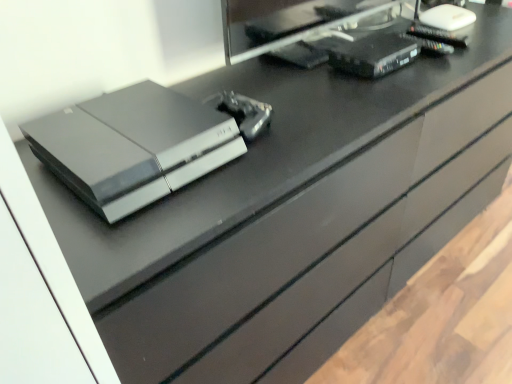
This screenshot has height=384, width=512. What are the coordinates of `free space in front of satin black console at center` in the screenshot? It's located at [x=131, y=227].